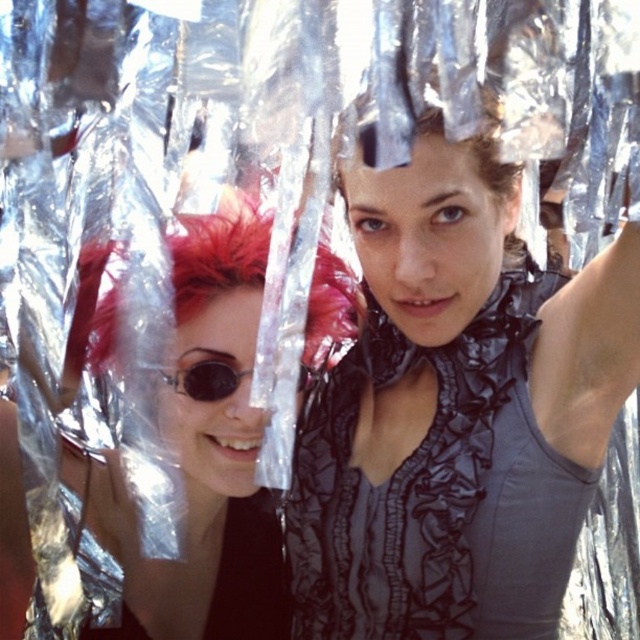
Between matte black dress at center and vivid red hair at center, which one has less height?

vivid red hair at center is shorter.

Is matte black dress at center positioned before vivid red hair at center?

Yes, matte black dress at center is closer to the viewer.

The image size is (640, 640). Describe the element at coordinates (456, 412) in the screenshot. I see `matte black dress at center` at that location.

You are a GUI agent. You are given a task and a screenshot of the screen. Output one action in this format:
    pyautogui.click(x=<x>, y=<y>)
    Task: Click on the matte black dress at center
    The width and height of the screenshot is (640, 640).
    Given the screenshot: What is the action you would take?
    pyautogui.click(x=456, y=412)

Is matte black dress at center thinner than shiny red hair at left?

Correct, matte black dress at center's width is less than shiny red hair at left's.

Which is below, matte black dress at center or shiny red hair at left?

shiny red hair at left is below.

At what (x,y) coordinates should I click in order to perform the action: click on matte black dress at center. Please return your answer as a coordinate pair (x, y). Looking at the image, I should click on (456, 412).

Find the location of a particular element. Image resolution: width=640 pixels, height=640 pixels. matte black dress at center is located at coordinates (456, 412).

From the picture: Does vivid red hair at center appear under sunglasses at center?

No.

Who is more distant from viewer, (179, 268) or (307, 371)?

Positioned behind is point (307, 371).

The height and width of the screenshot is (640, 640). What are the coordinates of `vivid red hair at center` in the screenshot? It's located at (218, 253).